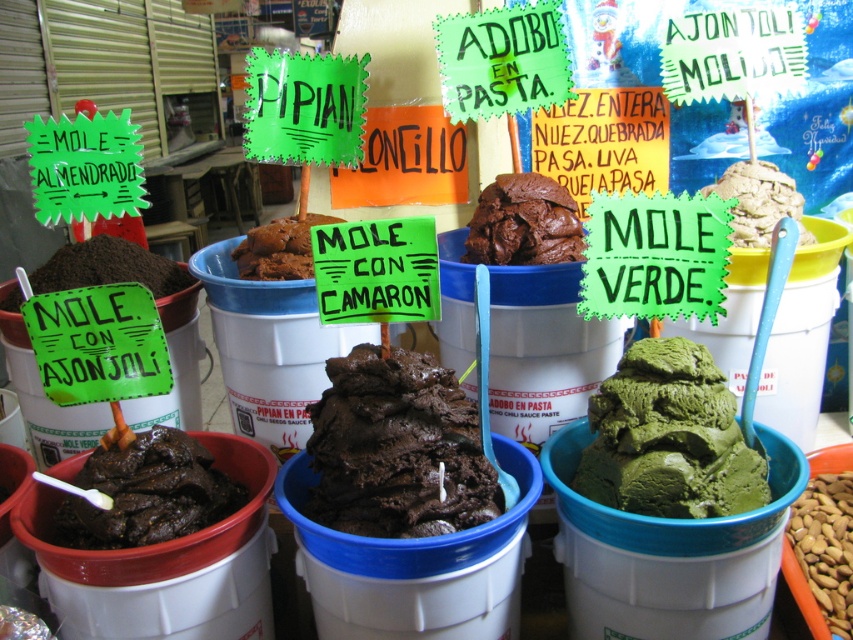
Between chocolate paste at center and green smooth paste at center, which one appears on the left side from the viewer's perspective?

Positioned to the left is chocolate paste at center.

Can you confirm if chocolate paste at center is bigger than green smooth paste at center?

No.

Where is `chocolate paste at center`? chocolate paste at center is located at coordinates (523, 221).

Is green matte ice cream at center smaller than brown powder at left?

Indeed, green matte ice cream at center has a smaller size compared to brown powder at left.

Is green matte ice cream at center below brown powder at left?

Correct, green matte ice cream at center is located below brown powder at left.

Locate an element on the screen. green matte ice cream at center is located at coordinates (669, 436).

The height and width of the screenshot is (640, 853). Find the location of `green matte ice cream at center`. green matte ice cream at center is located at coordinates (669, 436).

Is dark brown paste at lower left to the right of green smooth paste at center from the viewer's perspective?

No, dark brown paste at lower left is not to the right of green smooth paste at center.

Consider the image. Can you confirm if dark brown paste at lower left is taller than green smooth paste at center?

Incorrect, dark brown paste at lower left's height is not larger of green smooth paste at center's.

Measure the distance between dark brown paste at lower left and camera.

dark brown paste at lower left and camera are 1.37 meters apart.

I want to click on dark brown paste at lower left, so click(148, 493).